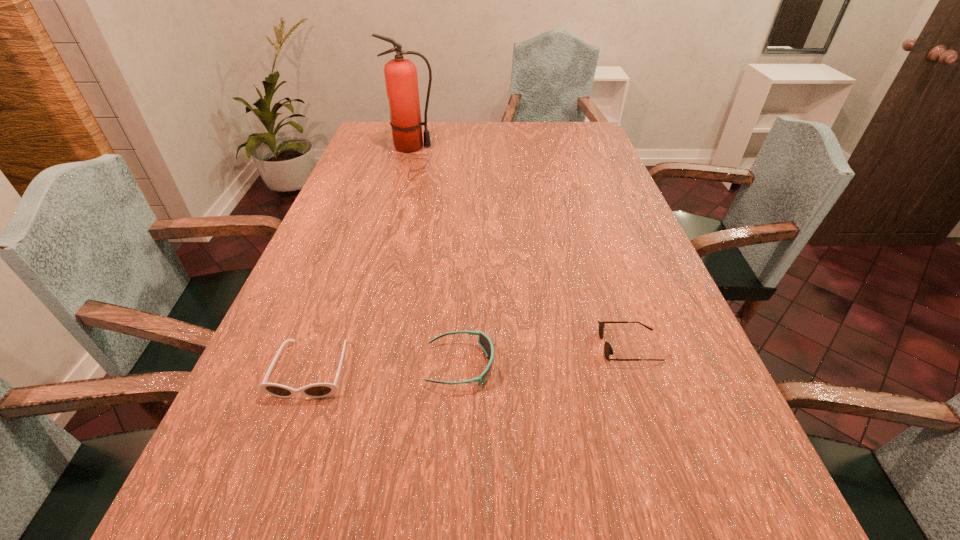
I want to click on the tallest object, so click(x=401, y=79).

I want to click on fire extinguisher, so click(x=401, y=79).

At what (x,y) coordinates should I click in order to perform the action: click on the third object from left to right. Please return your answer as a coordinate pair (x, y). Image resolution: width=960 pixels, height=540 pixels. Looking at the image, I should click on (484, 341).

The image size is (960, 540). I want to click on the leftmost sunglasses, so click(x=317, y=390).

You are a GUI agent. You are given a task and a screenshot of the screen. Output one action in this format:
    pyautogui.click(x=<x>, y=<y>)
    Task: Click on the rightmost object
    The image size is (960, 540).
    Given the screenshot: What is the action you would take?
    pyautogui.click(x=608, y=350)

The image size is (960, 540). What are the coordinates of `the shortest object` in the screenshot? It's located at (608, 350).

The image size is (960, 540). Find the location of `vacant space positioned on the nozzle of the tallest object`. vacant space positioned on the nozzle of the tallest object is located at coordinates (472, 147).

Locate an element on the screen. This screenshot has height=540, width=960. free spot located on the front-facing side of the second object from right to left is located at coordinates coord(540,365).

I want to click on vacant space located 0.070m with the lenses of the leftmost sunglasses facing outward, so click(x=288, y=437).

The width and height of the screenshot is (960, 540). Identify the location of vacant area situated on the front-facing side of the shortest sunglasses. (528, 346).